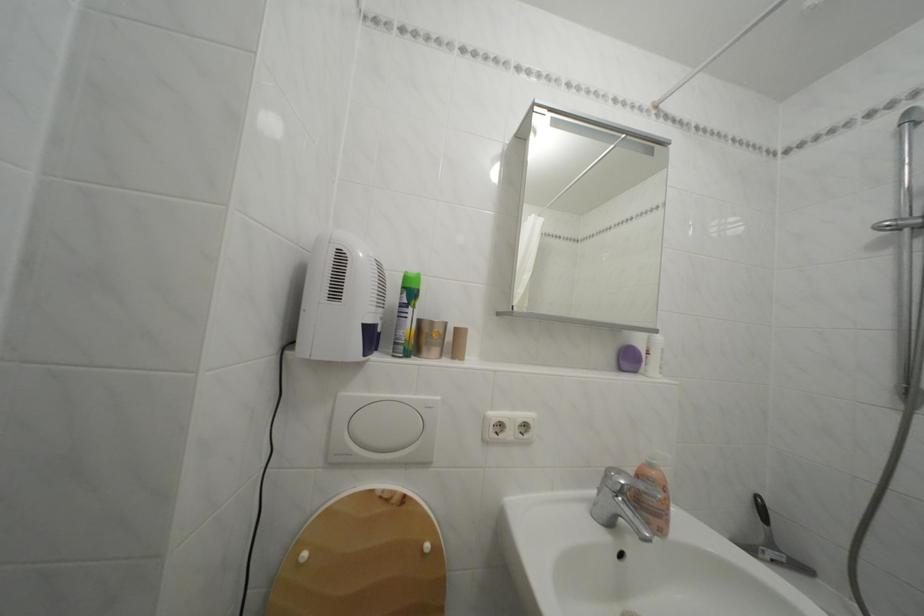
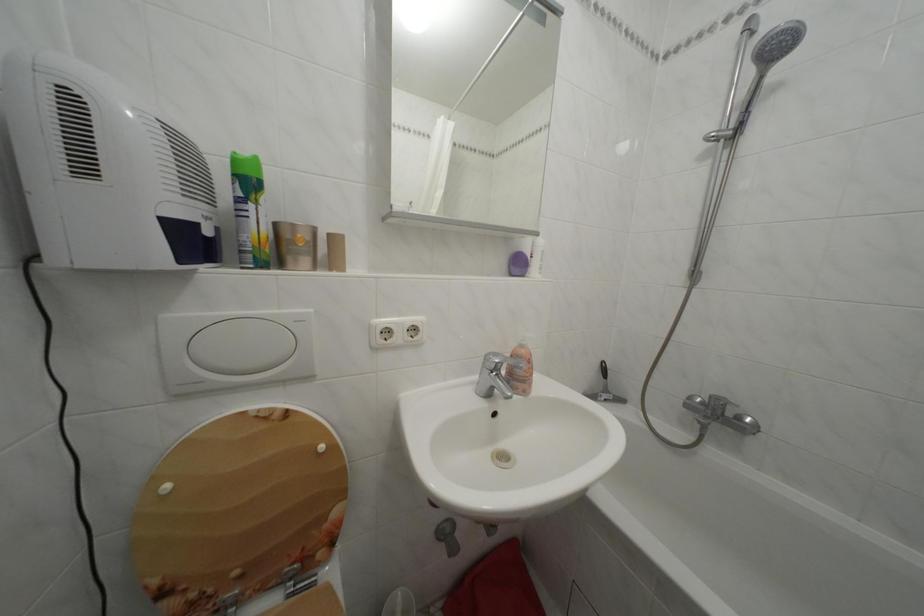
Locate, in the second image, the point that corresponds to pixel 350 400 in the first image.

(174, 323)